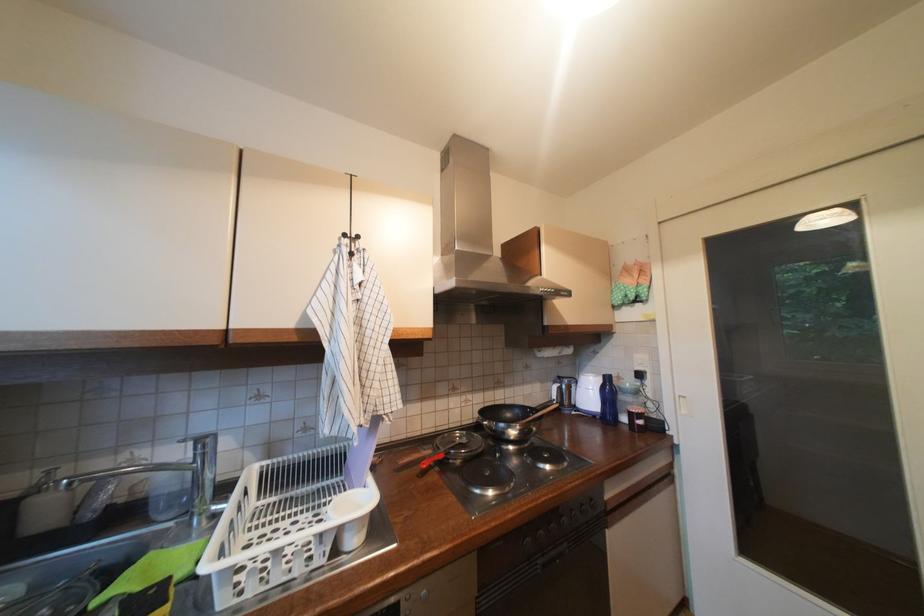
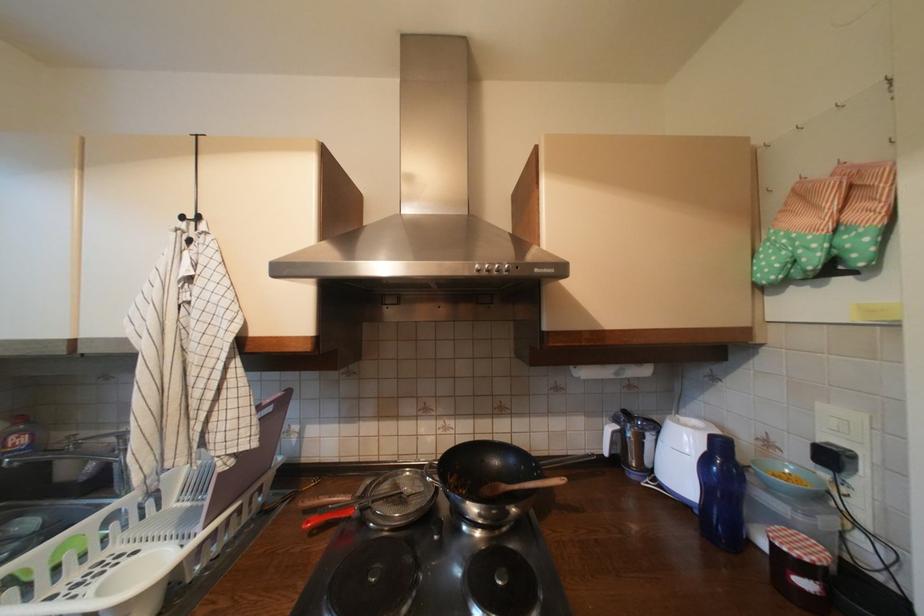
Question: I am providing you with two images of the same scene from different viewpoints. After the viewpoint changes to image2, which objects are now occluded?

Choices:
 (A) strainer handle
 (B) blue water bottle
 (C) green oven mitt
 (D) none of these

Answer: (D)